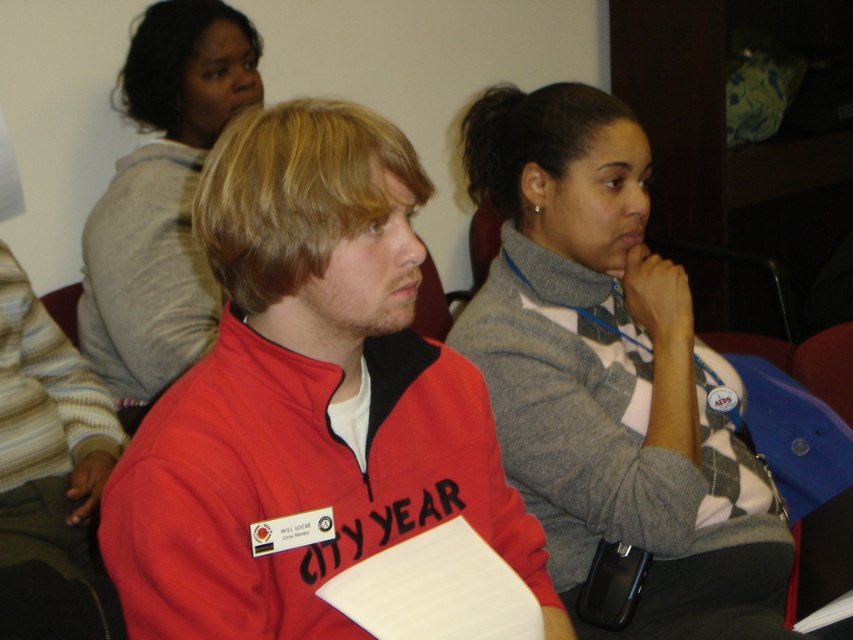
Consider the image. Can you confirm if red fleece sweatshirt at center is bigger than gray sweater at upper center?

Incorrect, red fleece sweatshirt at center is not larger than gray sweater at upper center.

Can you confirm if red fleece sweatshirt at center is positioned to the left of gray sweater at upper center?

Incorrect, red fleece sweatshirt at center is not on the left side of gray sweater at upper center.

Find the location of `red fleece sweatshirt at center`. red fleece sweatshirt at center is located at coordinates (306, 397).

How much distance is there between red fleece sweatshirt at center and gray sweater at center?

red fleece sweatshirt at center and gray sweater at center are 14.43 inches apart from each other.

Locate an element on the screen. The height and width of the screenshot is (640, 853). red fleece sweatshirt at center is located at coordinates (306, 397).

Where is `red fleece sweatshirt at center`? The width and height of the screenshot is (853, 640). red fleece sweatshirt at center is located at coordinates (306, 397).

Is gray sweater at center wider than gray sweater at upper center?

Correct, the width of gray sweater at center exceeds that of gray sweater at upper center.

Is point (616, 360) farther from camera compared to point (93, 252)?

That is False.

At what (x,y) coordinates should I click in order to perform the action: click on gray sweater at center. Please return your answer as a coordinate pair (x, y). Image resolution: width=853 pixels, height=640 pixels. Looking at the image, I should click on (611, 374).